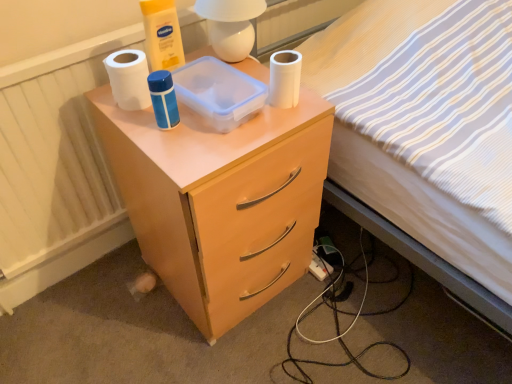
Where is `vacant space situated on the left part of white matte toilet paper at upper center, which appears as the 2th toilet paper when viewed from the left`? This screenshot has width=512, height=384. vacant space situated on the left part of white matte toilet paper at upper center, which appears as the 2th toilet paper when viewed from the left is located at coordinates (218, 127).